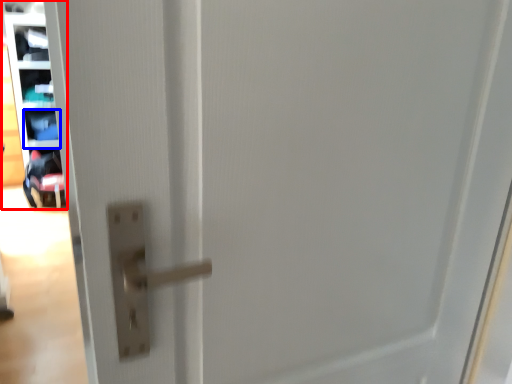
Question: Which object is closer to the camera taking this photo, shelf (highlighted by a red box) or shelf (highlighted by a blue box)?

Choices:
 (A) shelf
 (B) shelf

Answer: (A)